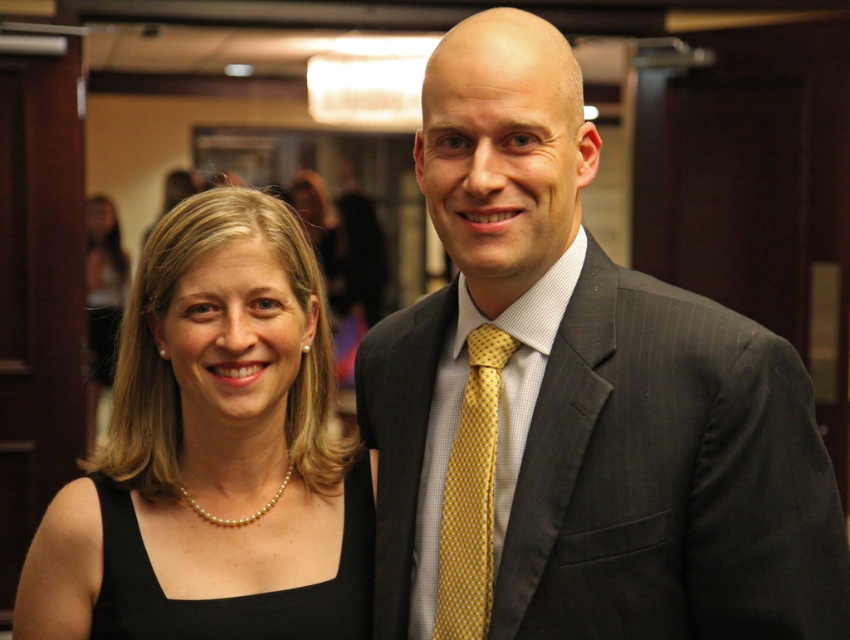
You are standing in the same room as the two people in the image. You want to move from the point marked by the coordinate point at (449, 497) to the point marked by the coordinate point at (115, 323). Which direction should you move in relation to the two people?

You should move towards the back of the two people because point (449, 497) is in front of point (115, 323), so moving from the front to the back would lead you to the desired point.

You are standing in a conference room and need to place a small gift box at point (276, 636). If you are currently 1.5 meters away from the camera, will you need to move closer or farther to reach that point?

The distance of point (276, 636) from the camera is 1.68 meters. Since you are currently 1.5 meters away from the camera, you need to move closer to reach the point.

You are a photographer who needs to adjust the lighting between the yellow dotted tie at center and the pearl necklace at upper left. Since they are 5.41 meters apart, what is the minimum distance you should set your camera to focus on both objects clearly?

The minimum distance should be set to 5.41 meters to ensure both the yellow dotted tie at center and the pearl necklace at upper left are in focus.